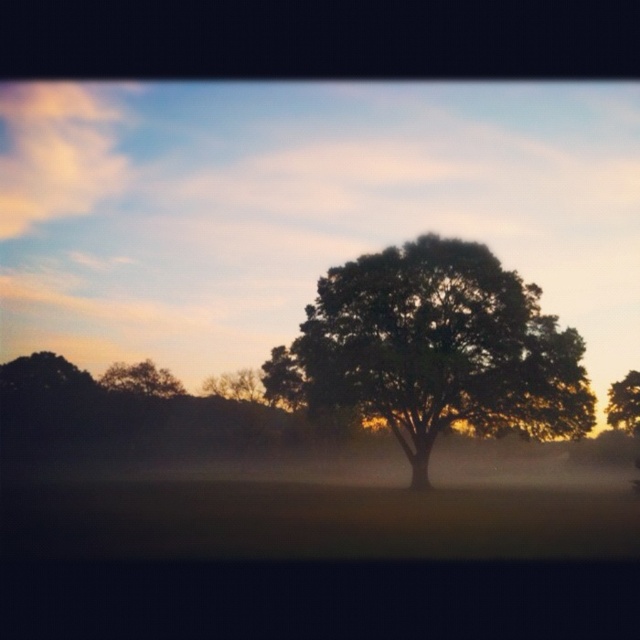
Question: Can you confirm if green leafy tree at center is positioned to the right of green leafy tree at right?

Choices:
 (A) no
 (B) yes

Answer: (A)

Question: Which of the following is the closest to the observer?

Choices:
 (A) green leafy tree at right
 (B) green leafy tree at center
 (C) green leafy oak tree at center

Answer: (C)

Question: Which of the following is the farthest from the observer?

Choices:
 (A) green leafy tree at center
 (B) green leafy tree at left
 (C) green leafy oak tree at center

Answer: (B)

Question: Which object is the farthest from the green leafy tree at left?

Choices:
 (A) green leafy oak tree at center
 (B) green leafy tree at center

Answer: (A)

Question: Is green leafy tree at left above green leafy tree at right?

Choices:
 (A) no
 (B) yes

Answer: (B)

Question: Is green leafy tree at center to the left of green leafy oak tree at center from the viewer's perspective?

Choices:
 (A) yes
 (B) no

Answer: (B)